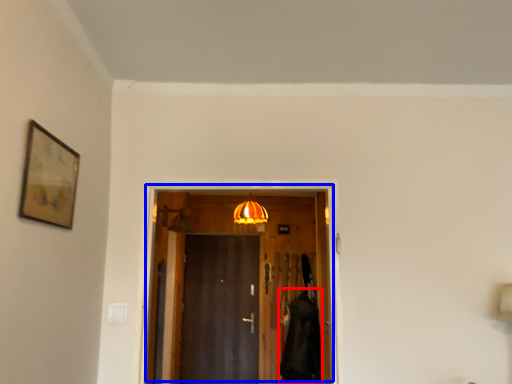
Question: Which point is further to the camera, robe (highlighted by a red box) or door (highlighted by a blue box)?

Choices:
 (A) robe
 (B) door

Answer: (A)